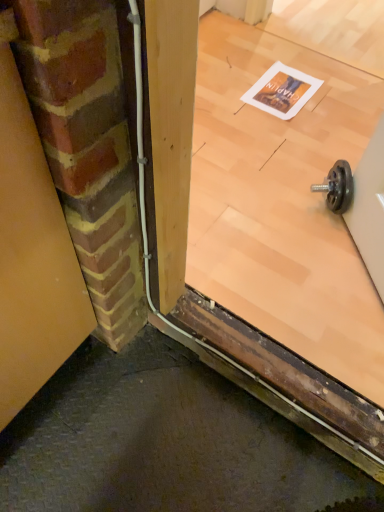
Measure the distance between point (249, 73) and camera.

They are 1.66 meters apart.

Describe the element at coordinates (282, 243) in the screenshot. I see `transparent glass door at center` at that location.

The width and height of the screenshot is (384, 512). In order to click on transparent glass door at center in this screenshot , I will do `click(282, 243)`.

What is the approximate height of matte yellow garage door at left?

The height of matte yellow garage door at left is 89.71 centimeters.

Image resolution: width=384 pixels, height=512 pixels. I want to click on matte yellow garage door at left, so click(32, 252).

This screenshot has width=384, height=512. What do you see at coordinates (32, 252) in the screenshot?
I see `matte yellow garage door at left` at bounding box center [32, 252].

I want to click on transparent glass door at center, so click(282, 243).

Is matte yellow garage door at left at the right side of transparent glass door at center?

No, matte yellow garage door at left is not to the right of transparent glass door at center.

Is matte yellow garage door at left closer to the viewer compared to transparent glass door at center?

Yes, the depth of matte yellow garage door at left is less than that of transparent glass door at center.

Is point (66, 288) less distant than point (370, 319)?

Yes, it is in front of point (370, 319).

From the image's perspective, is matte yellow garage door at left located above or below transparent glass door at center?

matte yellow garage door at left is below transparent glass door at center.

From a real-world perspective, which object stands above the other?

matte yellow garage door at left.

Is matte yellow garage door at left wider than transparent glass door at center?

In fact, matte yellow garage door at left might be narrower than transparent glass door at center.

Who is taller, matte yellow garage door at left or transparent glass door at center?

matte yellow garage door at left.

Does matte yellow garage door at left have a smaller size compared to transparent glass door at center?

Yes, matte yellow garage door at left is smaller than transparent glass door at center.

Can we say matte yellow garage door at left lies outside transparent glass door at center?

Yes, matte yellow garage door at left is located beyond the bounds of transparent glass door at center.

Would you say matte yellow garage door at left is a long distance from transparent glass door at center?

They are positioned close to each other.

Is matte yellow garage door at left turned away from transparent glass door at center?

Absolutely, matte yellow garage door at left is directed away from transparent glass door at center.

I want to click on window above the matte yellow garage door at left (from the image's perspective), so click(282, 243).

Can you confirm if transparent glass door at center is positioned to the right of matte yellow garage door at left?

Yes, transparent glass door at center is to the right of matte yellow garage door at left.

Between transparent glass door at center and matte yellow garage door at left, which one is positioned in front?

matte yellow garage door at left.

Which is closer, (379, 354) or (36, 384)?

Point (379, 354).

From the image's perspective, which object appears higher, transparent glass door at center or matte yellow garage door at left?

transparent glass door at center is shown above in the image.

From a real-world perspective, is transparent glass door at center positioned over matte yellow garage door at left based on gravity?

Incorrect, from a real-world perspective, transparent glass door at center is lower than matte yellow garage door at left.

Can you confirm if transparent glass door at center is wider than matte yellow garage door at left?

Yes.

Can you confirm if transparent glass door at center is taller than matte yellow garage door at left?

In fact, transparent glass door at center may be shorter than matte yellow garage door at left.

Does transparent glass door at center have a larger size compared to matte yellow garage door at left?

Yes.

Is transparent glass door at center positioned beyond the bounds of matte yellow garage door at left?

transparent glass door at center is positioned outside matte yellow garage door at left.

Are transparent glass door at center and matte yellow garage door at left located far from each other?

No, transparent glass door at center is not far from matte yellow garage door at left.

Is transparent glass door at center oriented away from matte yellow garage door at left?

transparent glass door at center is not turned away from matte yellow garage door at left.

How different are the orientations of transparent glass door at center and matte yellow garage door at left in degrees?

There is a 0.0697-degree angle between the facing directions of transparent glass door at center and matte yellow garage door at left.

What are the coordinates of `window that appears below the matte yellow garage door at left (from a real-world perspective)` in the screenshot? It's located at (282, 243).

Identify the location of window behind the matte yellow garage door at left. This screenshot has width=384, height=512. coord(282,243).

Where is `garage door that appears on the left of transparent glass door at center`? The image size is (384, 512). garage door that appears on the left of transparent glass door at center is located at coordinates (32, 252).